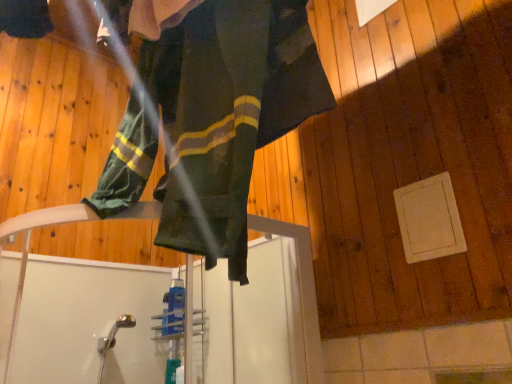
What do you see at coordinates (213, 119) in the screenshot?
I see `green fabric pants at center` at bounding box center [213, 119].

Image resolution: width=512 pixels, height=384 pixels. Identify the location of green fabric pants at center. (213, 119).

What is the approximate height of green fabric pants at center?

green fabric pants at center is 84.19 centimeters in height.

Measure the distance between point [104,172] and camera.

1.21 meters.

This screenshot has width=512, height=384. Describe the element at coordinates (429, 219) in the screenshot. I see `white matte panel at lower right` at that location.

The width and height of the screenshot is (512, 384). What are the coordinates of `white matte panel at lower right` in the screenshot? It's located at (429, 219).

The width and height of the screenshot is (512, 384). I want to click on green fabric pants at center, so click(213, 119).

Is white matte panel at lower right to the left or to the right of green fabric pants at center in the image?

white matte panel at lower right is to the right of green fabric pants at center.

Between white matte panel at lower right and green fabric pants at center, which one is positioned in front?

green fabric pants at center is more forward.

Does point (450, 197) lie in front of point (138, 106)?

Yes, it is in front of point (138, 106).

From the image's perspective, which one is positioned higher, white matte panel at lower right or green fabric pants at center?

green fabric pants at center is shown above in the image.

From a real-world perspective, which object stands above the other?

green fabric pants at center is physically above.

Looking at this image, does white matte panel at lower right have a lesser width compared to green fabric pants at center?

Yes, white matte panel at lower right is thinner than green fabric pants at center.

Considering the sizes of objects white matte panel at lower right and green fabric pants at center in the image provided, who is taller, white matte panel at lower right or green fabric pants at center?

With more height is green fabric pants at center.

In terms of size, does white matte panel at lower right appear bigger or smaller than green fabric pants at center?

Clearly, white matte panel at lower right is smaller in size than green fabric pants at center.

Is white matte panel at lower right surrounding green fabric pants at center?

No, green fabric pants at center is not a part of white matte panel at lower right.

Are white matte panel at lower right and green fabric pants at center making contact?

No, white matte panel at lower right is not in contact with green fabric pants at center.

Is green fabric pants at center at the back of white matte panel at lower right?

That's not correct — white matte panel at lower right is not looking away from green fabric pants at center.

How many degrees apart are the facing directions of white matte panel at lower right and green fabric pants at center?

white matte panel at lower right and green fabric pants at center are facing 0.583 degrees away from each other.

How much distance is there between white matte panel at lower right and green fabric pants at center?

The distance of white matte panel at lower right from green fabric pants at center is 24.87 inches.

Find the location of a particular element. This screenshot has width=512, height=384. woman lying above the white matte panel at lower right (from the image's perspective) is located at coordinates (213, 119).

Would you say green fabric pants at center is to the left or to the right of white matte panel at lower right in the picture?

In the image, green fabric pants at center appears on the left side of white matte panel at lower right.

Which object is further away from the camera taking this photo, green fabric pants at center or white matte panel at lower right?

white matte panel at lower right is further away from the camera.

Which is in front, point (227, 216) or point (410, 203)?

The point (227, 216) is in front.

From the image's perspective, who appears lower, green fabric pants at center or white matte panel at lower right?

white matte panel at lower right appears lower in the image.

From a real-world perspective, is green fabric pants at center located beneath white matte panel at lower right?

No.

Can you confirm if green fabric pants at center is thinner than white matte panel at lower right?

Incorrect, the width of green fabric pants at center is not less than that of white matte panel at lower right.

Does green fabric pants at center have a greater height compared to white matte panel at lower right?

Correct, green fabric pants at center is much taller as white matte panel at lower right.

Which of these two, green fabric pants at center or white matte panel at lower right, is bigger?

With larger size is green fabric pants at center.

Choose the correct answer: Is green fabric pants at center inside white matte panel at lower right or outside it?

green fabric pants at center lies outside white matte panel at lower right.

Is green fabric pants at center next to white matte panel at lower right?

green fabric pants at center and white matte panel at lower right are not in contact.

Is green fabric pants at center looking in the opposite direction of white matte panel at lower right?

Yes, green fabric pants at center is facing away from white matte panel at lower right.

How many degrees apart are the facing directions of green fabric pants at center and white matte panel at lower right?

Result: There is a 0.583-degree angle between the facing directions of green fabric pants at center and white matte panel at lower right.

Where is `woman lying on the left of white matte panel at lower right`? woman lying on the left of white matte panel at lower right is located at coordinates (213, 119).

Identify the location of panel below the green fabric pants at center (from the image's perspective). (429, 219).

Where is `woman above the white matte panel at lower right (from the image's perspective)`? woman above the white matte panel at lower right (from the image's perspective) is located at coordinates (213, 119).